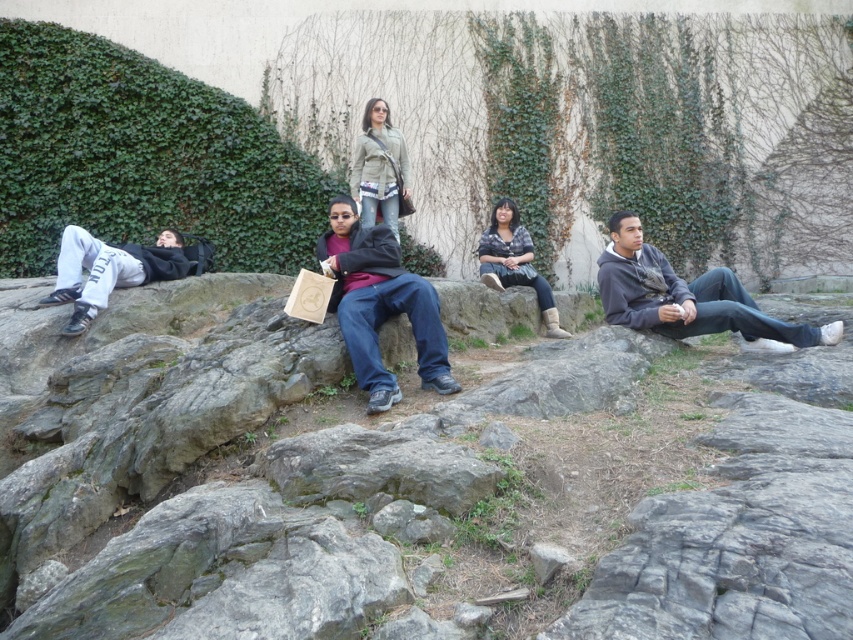
You are standing at the origin point of the coordinate system. You want to place a flag at the gray rock at center. What are the coordinates where you should place the flag?

The coordinates for placing the flag at the gray rock at center are at point [426,492].

You are standing at the point labeled point (483, 259) and want to move towards the point labeled point (97, 500). Based on the scene description, which direction should you move relative to your current position?

You should move forward because point (97, 500) is in front of point (483, 259).

You are a photographer trying to capture a clear shot of the matte green jacket at center and the green leafy ivy at upper left. However, the ivy is blocking part of the jacket. Can you adjust your position to see both objects without the ivy covering the jacket?

The matte green jacket at center is behind the green leafy ivy at upper left, so moving your position slightly to the side or forward might allow you to see both objects without the ivy obstructing the jacket.